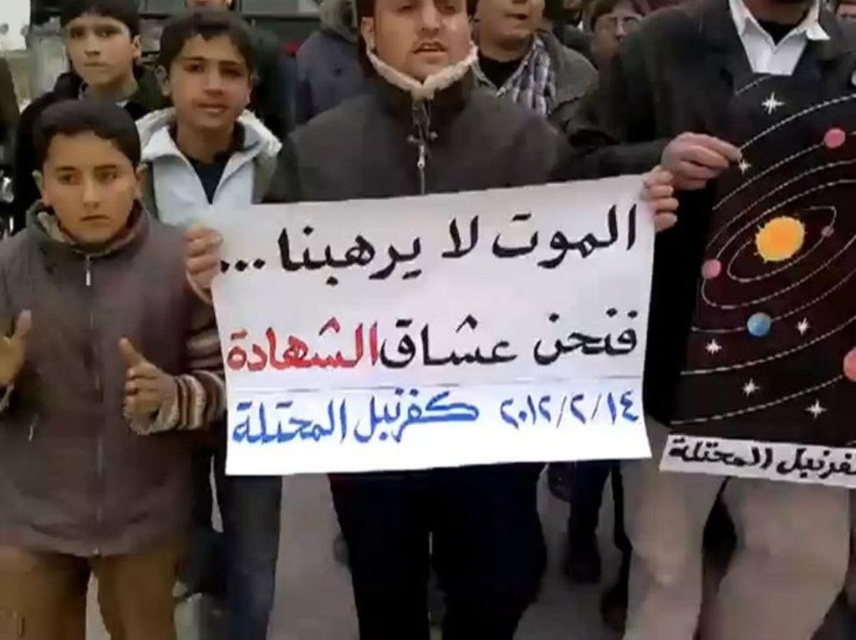
You are a photographer trying to capture the central figure holding the matte black sign at center and wearing the dark brown sweater at center. If you want to ensure both the sweater and the sign are fully visible in the frame, which object should you focus on first to avoid cropping?

Since the dark brown sweater at center is wider than the matte black sign at center, you should focus on framing the dark brown sweater at center first to ensure the entire sign is also captured without cropping.

What is located at the coordinates point [738,301] in the image?

The dark brown sweater at center is located at point [738,301].